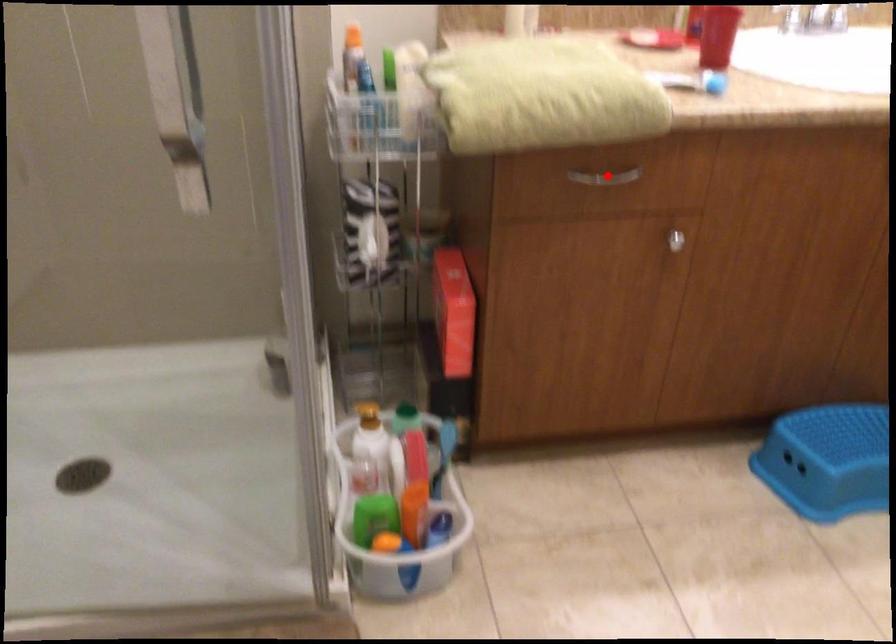
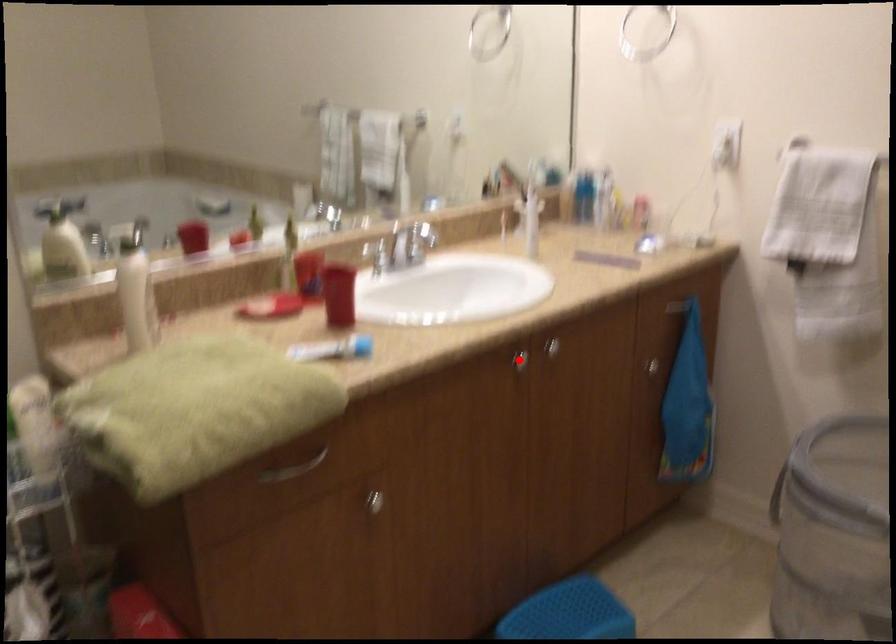
I am providing you with two images of the same scene from different viewpoints. A red point is marked on the first image and another point is marked on the second image. Is the marked point in image1 the same physical position as the marked point in image2?

No